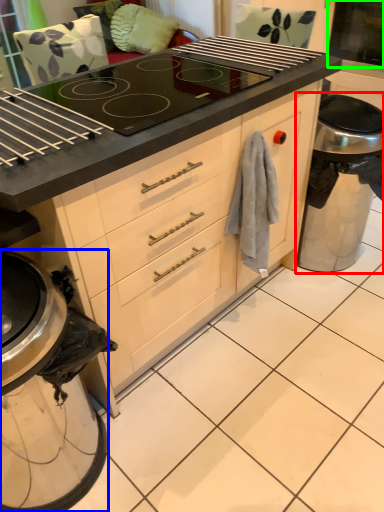
Question: Estimate the real-world distances between objects in this image. Which object is closer to appliance (highlighted by a red box), kitchen appliance (highlighted by a blue box) or screen door (highlighted by a green box)?

Choices:
 (A) kitchen appliance
 (B) screen door

Answer: (B)